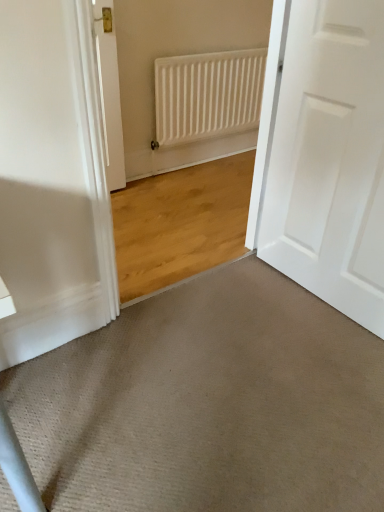
You are a GUI agent. You are given a task and a screenshot of the screen. Output one action in this format:
    pyautogui.click(x=<x>, y=<y>)
    Task: Click on the blank space situated above white matte radiator at upper center (from a real-world perspective)
    
    Given the screenshot: What is the action you would take?
    pyautogui.click(x=221, y=48)